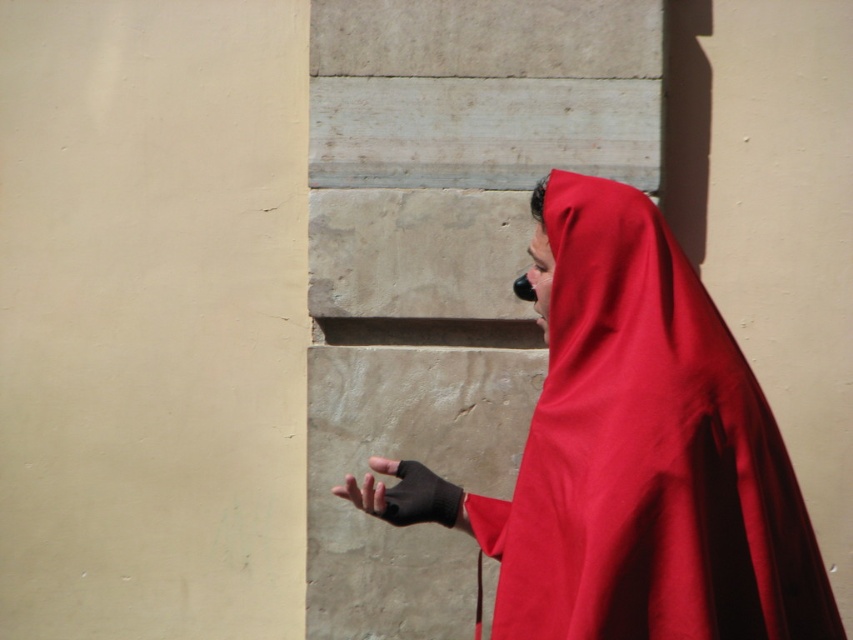
Question: Considering the relative positions of matte red cloak at right and black matte glove at center in the image provided, where is matte red cloak at right located with respect to black matte glove at center?

Choices:
 (A) left
 (B) right

Answer: (B)

Question: Which point is closer to the camera taking this photo?

Choices:
 (A) pos(399,509)
 (B) pos(581,428)

Answer: (B)

Question: In this image, where is matte red cloak at right located relative to black matte glove at center?

Choices:
 (A) below
 (B) above

Answer: (B)

Question: In this image, where is matte red cloak at right located relative to black matte glove at center?

Choices:
 (A) above
 (B) below

Answer: (A)

Question: Which object appears closest to the camera in this image?

Choices:
 (A) matte red cloak at right
 (B) black matte glove at center

Answer: (A)